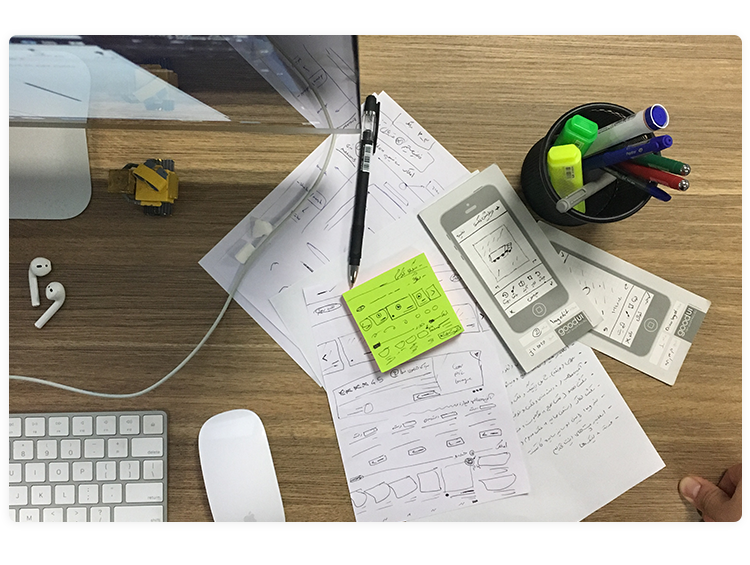
Identify the location of pen. (362, 189).